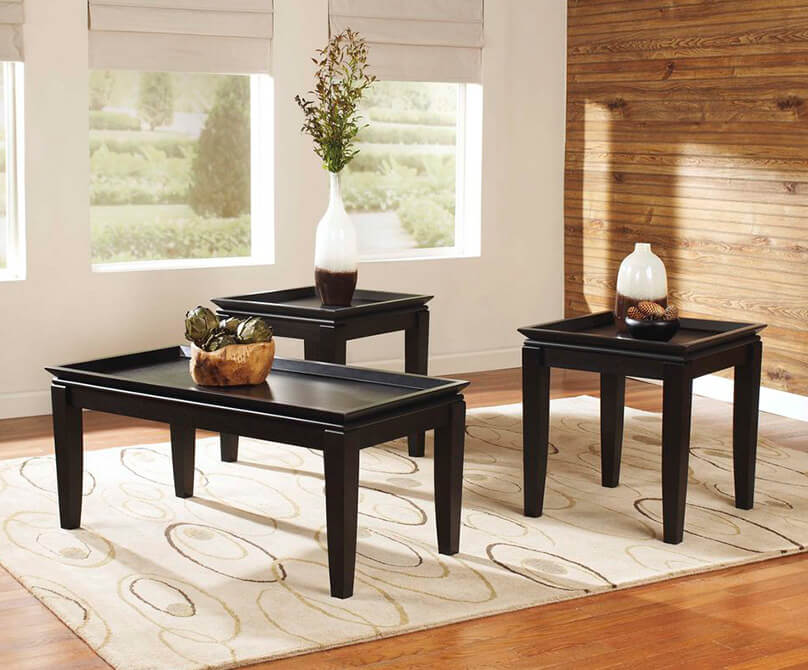
I want to click on windows, so click(x=11, y=202), click(x=128, y=191), click(x=414, y=183).